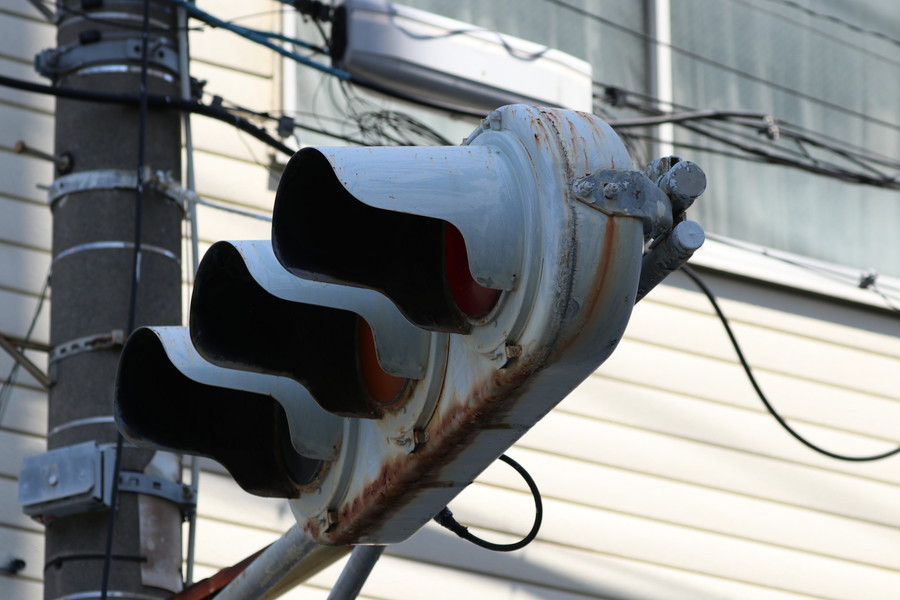
Find the location of a particular element. The height and width of the screenshot is (600, 900). bracket is located at coordinates (69, 351).